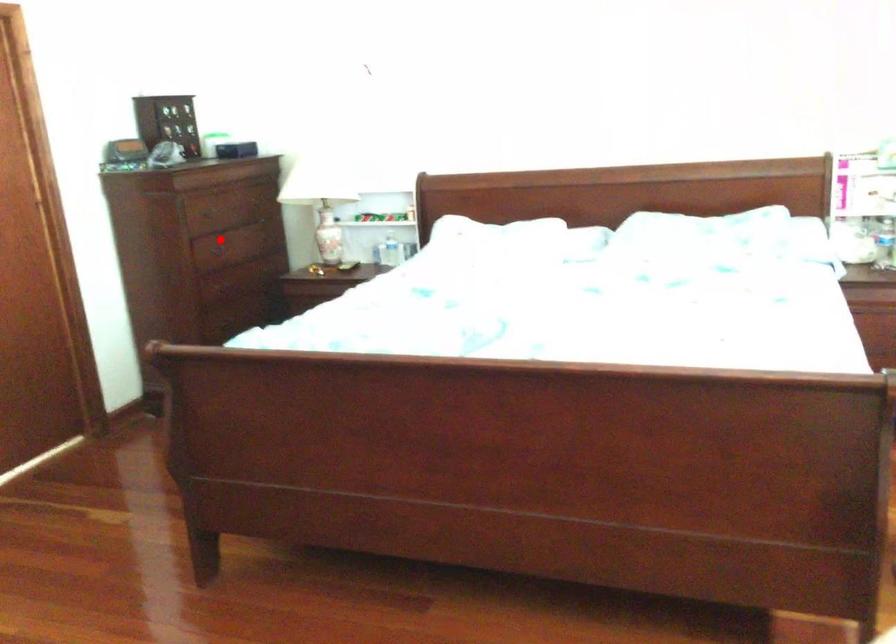
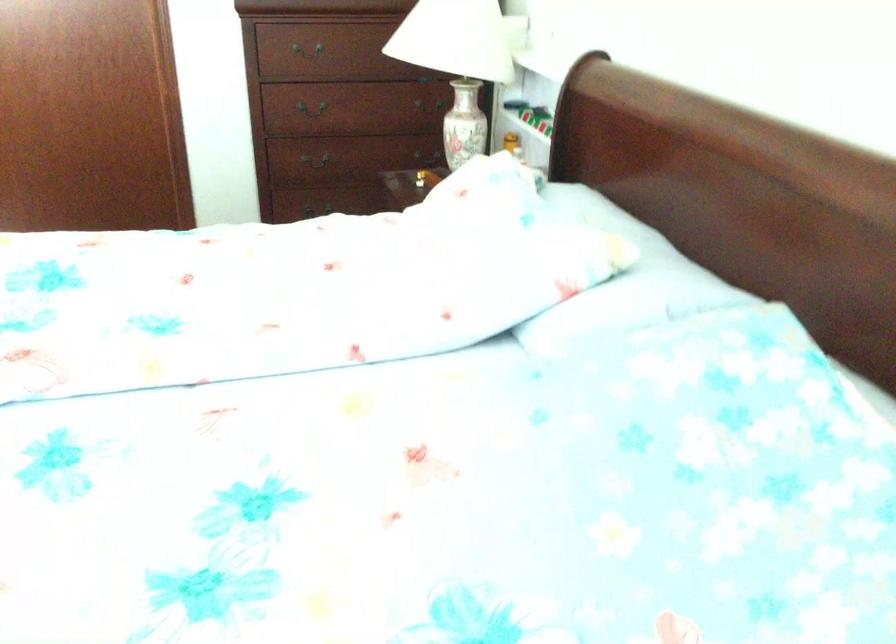
Question: I am providing you with two images of the same scene from different viewpoints. A red point is shown in image1. For the corresponding object point in image2, is it positioned nearer or farther from the camera?

Choices:
 (A) Nearer
 (B) Farther

Answer: (A)